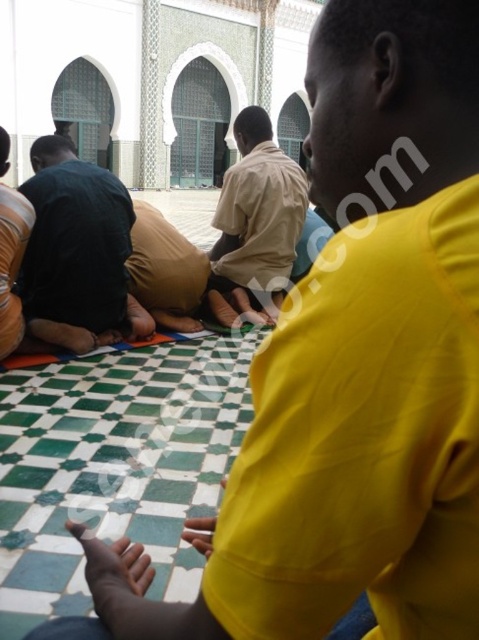
You are standing in the mosque and want to walk from point A to point B. Point A is located at coordinate point (x=299, y=204) and point B is at coordinate point (x=19, y=266). Which direction should you move to get from point A to point B?

To move from point A at (x=299, y=204) to point B at (x=19, y=266), you should move downward and to the right since point B is lower and further to the right compared to point A.

You are a photographer standing at the entrance of the mosque. You want to take a photo that includes both the beige cotton shirt at center and the dark brown leather shoes at lower left. Which object should you focus on first to ensure both are in frame?

The beige cotton shirt at center is taller than the dark brown leather shoes at lower left, so you should focus on the beige cotton shirt at center first to ensure both are in frame.